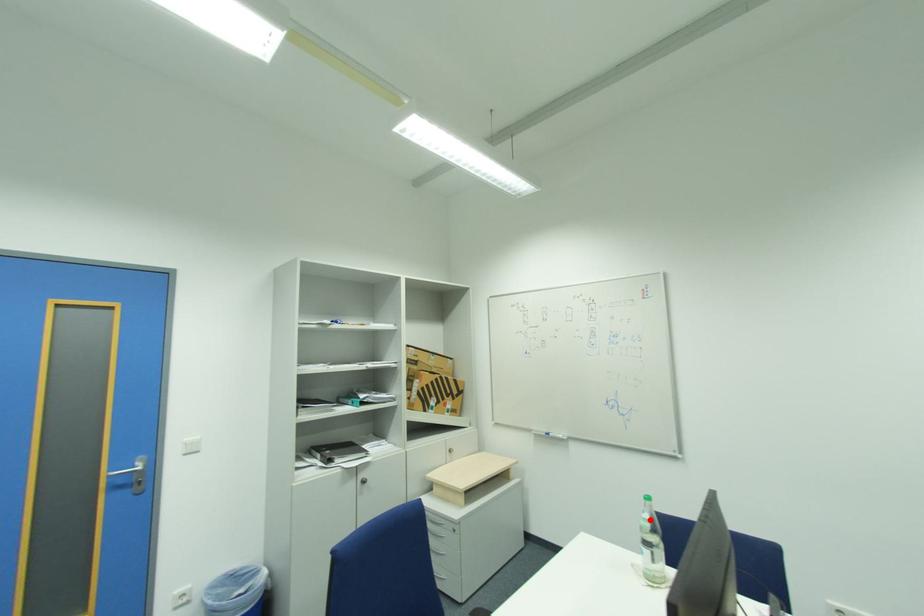
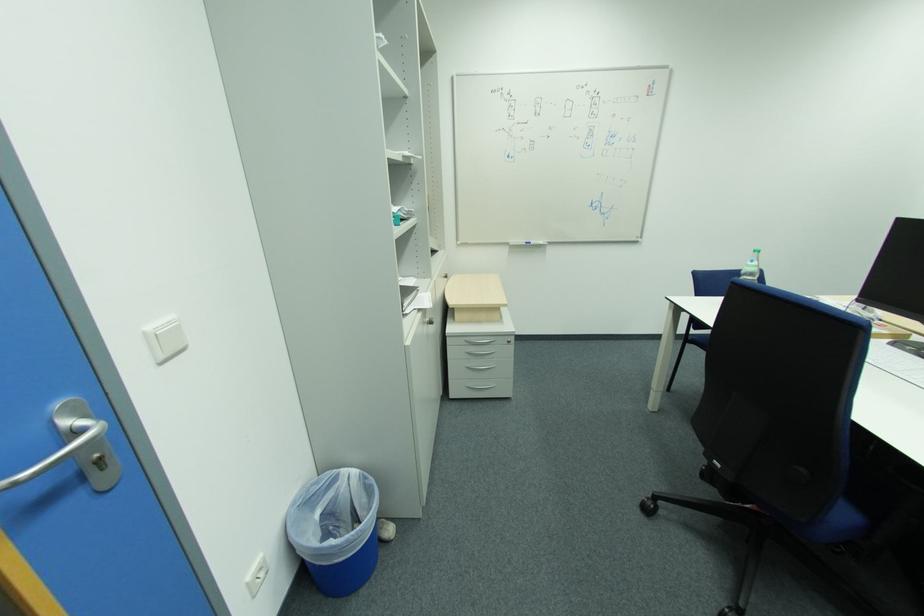
In the second image, find the point that corresponds to the highlighted location in the first image.

(758, 267)